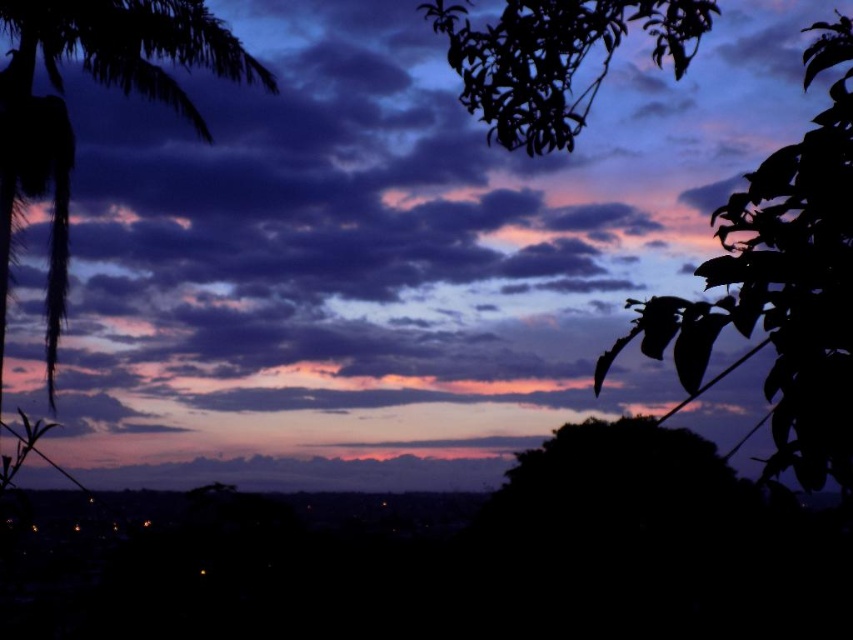
From the picture: You are an artist trying to paint the twilight scene. You have two brushes available. One is a thin brush for details, and the other is a thick brush for broader strokes. Based on the image, which brush should you use for the silky dark leaves at upper right and which for the silky black palm tree at left?

The silky dark leaves at upper right are thinner, so use the thin brush for details. The silky black palm tree at left is thicker, so use the thick brush for broader strokes.

You are an artist trying to sketch this scene. You want to ensure the silky dark leaves at upper right and the silky black palm tree at left are positioned correctly. Which object should be drawn first if you follow the rule of placing objects that are closer to the viewer before those further away?

The silky dark leaves at upper right should be drawn first because they are located below the silky black palm tree at left, indicating they are closer to the viewer.